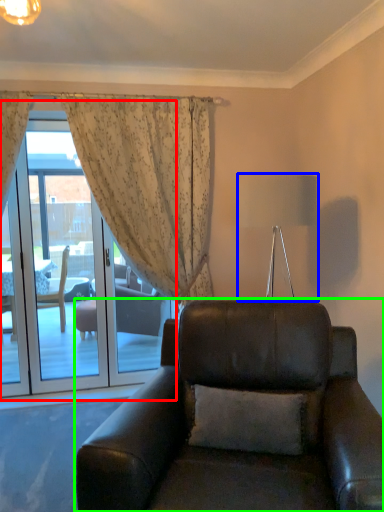
Question: Estimate the real-world distances between objects in this image. Which object is closer to screen door (highlighted by a red box), lamp (highlighted by a blue box) or chair (highlighted by a green box)?

Choices:
 (A) lamp
 (B) chair

Answer: (B)